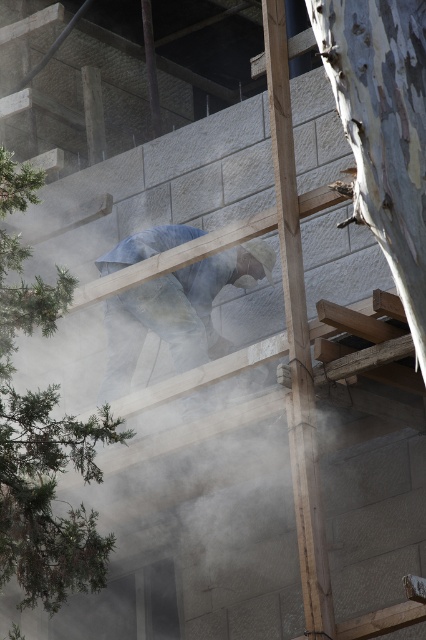
Can you confirm if smooth wood beam at center is positioned below blue denim jeans at center?

Correct, smooth wood beam at center is located below blue denim jeans at center.

Can you confirm if smooth wood beam at center is bigger than blue denim jeans at center?

Incorrect, smooth wood beam at center is not larger than blue denim jeans at center.

Which is behind, point (314, 632) or point (201, 355)?

Point (201, 355)

At what (x,y) coordinates should I click in order to perform the action: click on smooth wood beam at center. Please return your answer as a coordinate pair (x, y). Looking at the image, I should click on (296, 339).